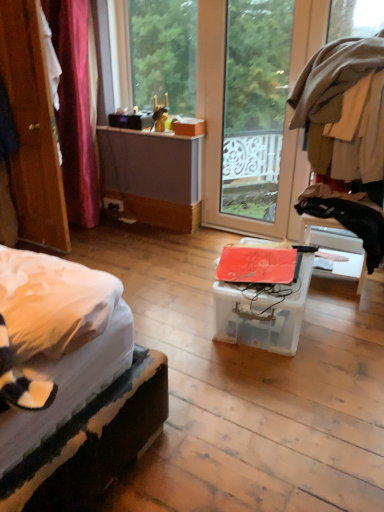
Question: Considering the relative sizes of black fabric at right and black plastic power outlet at lower left in the image provided, is black fabric at right shorter than black plastic power outlet at lower left?

Choices:
 (A) yes
 (B) no

Answer: (B)

Question: From the image's perspective, is black fabric at right below black plastic power outlet at lower left?

Choices:
 (A) yes
 (B) no

Answer: (A)

Question: Is black fabric at right aimed at black plastic power outlet at lower left?

Choices:
 (A) no
 (B) yes

Answer: (A)

Question: From a real-world perspective, is black fabric at right beneath black plastic power outlet at lower left?

Choices:
 (A) yes
 (B) no

Answer: (B)

Question: Is black fabric at right outside black plastic power outlet at lower left?

Choices:
 (A) no
 (B) yes

Answer: (B)

Question: Considering the relative sizes of black fabric at right and black plastic power outlet at lower left in the image provided, is black fabric at right taller than black plastic power outlet at lower left?

Choices:
 (A) yes
 (B) no

Answer: (A)

Question: Is transparent plastic box at center to the right of black plastic power outlet at lower left from the viewer's perspective?

Choices:
 (A) no
 (B) yes

Answer: (B)

Question: Is transparent plastic box at center in contact with black plastic power outlet at lower left?

Choices:
 (A) yes
 (B) no

Answer: (B)

Question: From the image's perspective, is transparent plastic box at center under black plastic power outlet at lower left?

Choices:
 (A) yes
 (B) no

Answer: (A)

Question: From a real-world perspective, is transparent plastic box at center beneath black plastic power outlet at lower left?

Choices:
 (A) yes
 (B) no

Answer: (B)

Question: Is transparent plastic box at center taller than black plastic power outlet at lower left?

Choices:
 (A) yes
 (B) no

Answer: (A)

Question: Could black plastic power outlet at lower left be considered to be inside transparent plastic box at center?

Choices:
 (A) no
 (B) yes

Answer: (A)

Question: Does wooden door at left have a greater width compared to transparent plastic box at center?

Choices:
 (A) yes
 (B) no

Answer: (B)